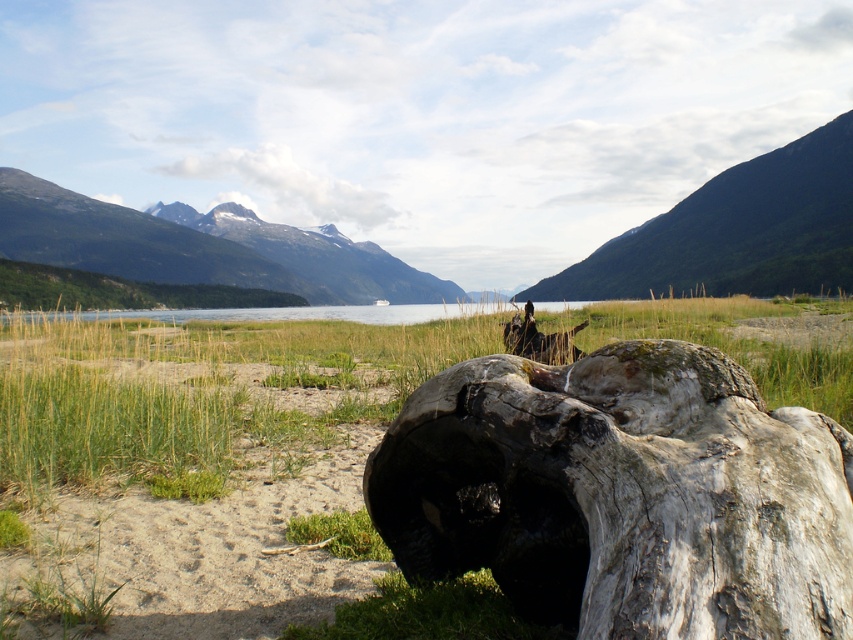
Question: Is green grass at lower left bigger than green forested mountain at upper left?

Choices:
 (A) no
 (B) yes

Answer: (A)

Question: Which object is the farthest from the green grass at lower left?

Choices:
 (A) green forested mountain at upper left
 (B) green textured mountain at upper center

Answer: (B)

Question: Does green textured mountain at upper center appear under green forested mountain at upper left?

Choices:
 (A) no
 (B) yes

Answer: (A)

Question: Which point is closer to the camera?

Choices:
 (A) (357, 595)
 (B) (236, 269)
 (C) (809, 154)

Answer: (A)

Question: Does green grass at lower left appear under green forested mountain at upper left?

Choices:
 (A) yes
 (B) no

Answer: (A)

Question: Which is farther from the green forested mountain at upper left?

Choices:
 (A) green grass at lower left
 (B) green textured mountain at upper center

Answer: (A)